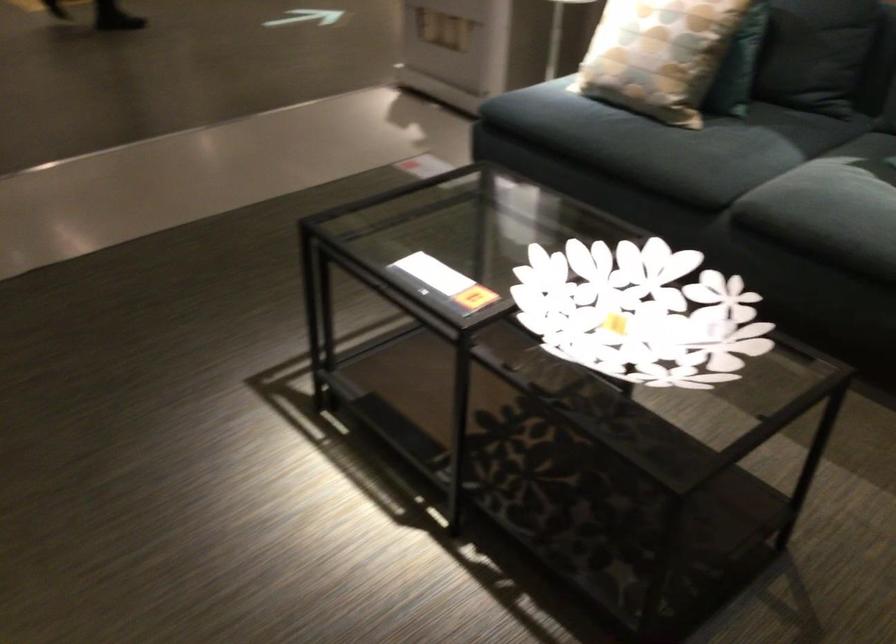
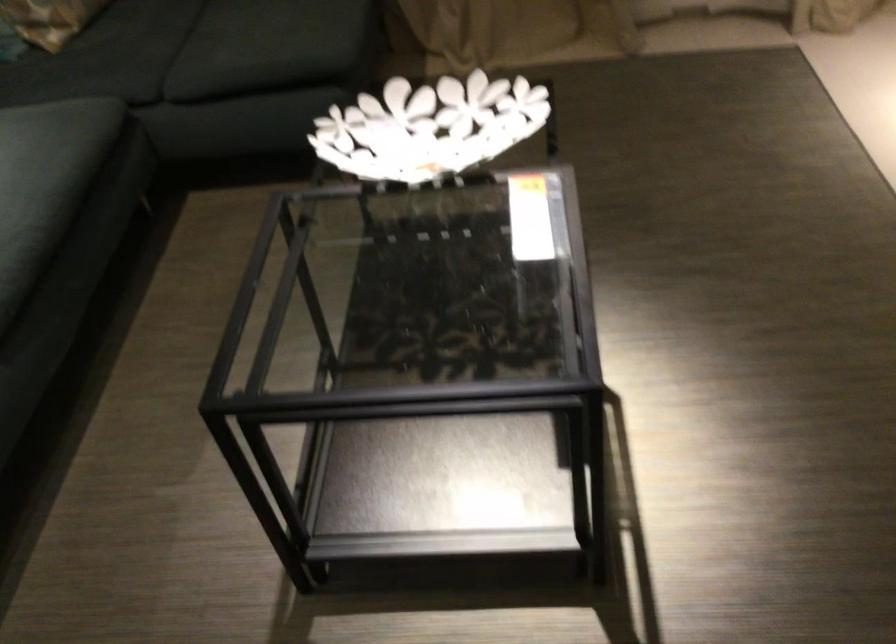
The point at [665,361] is marked in the first image. Where is the corresponding point in the second image?

(429, 127)